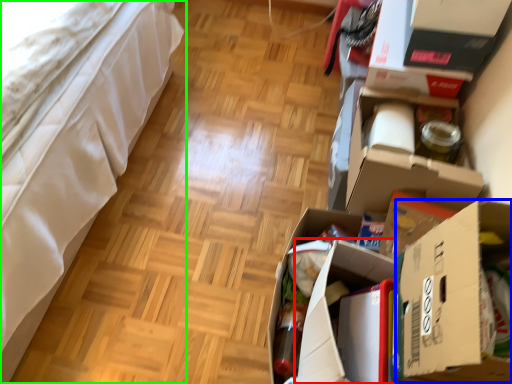
Question: Which is farther away from cardboard box (highlighted by a red box)? cardboard box (highlighted by a blue box) or furniture (highlighted by a green box)?

Choices:
 (A) cardboard box
 (B) furniture

Answer: (B)